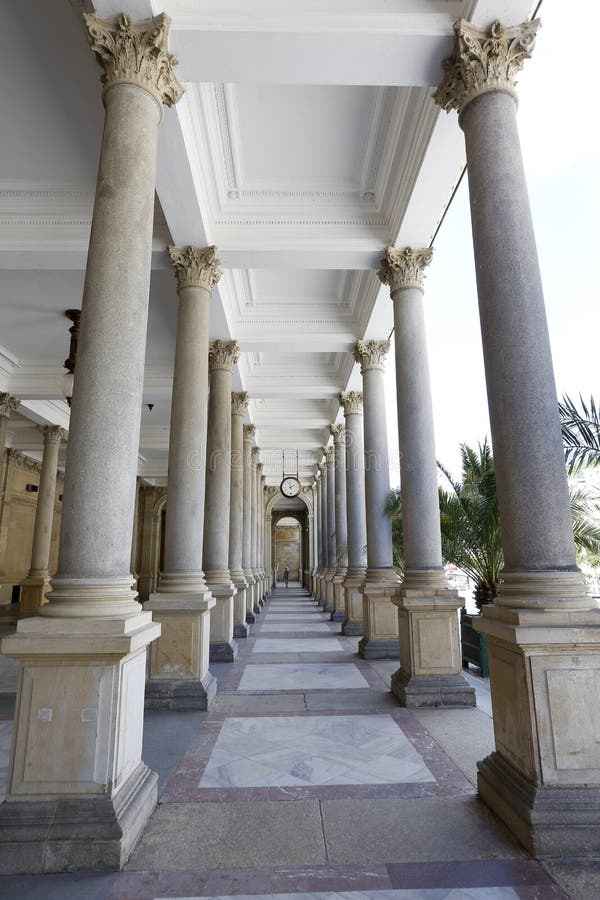
Image resolution: width=600 pixels, height=900 pixels. Find the location of `overhead lamp`. overhead lamp is located at coordinates (68, 384).